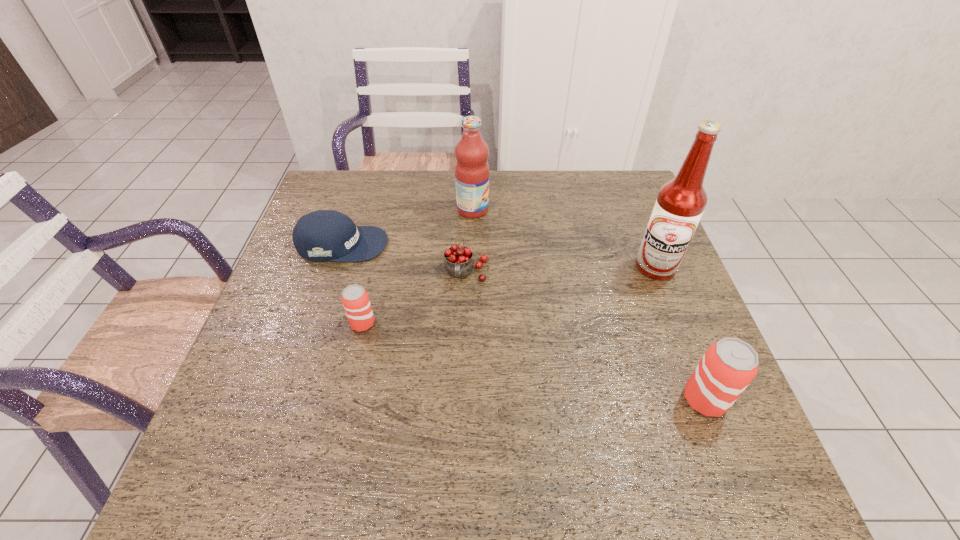
What are the coordinates of `free space located on the back of the right beer can` in the screenshot? It's located at (680, 335).

I want to click on vacant space situated on the front label of the farthest object, so click(544, 210).

You are a GUI agent. You are given a task and a screenshot of the screen. Output one action in this format:
    pyautogui.click(x=<x>, y=<y>)
    Task: Click on the vacant space situated 0.320m on the front-facing side of the baseball cap
    
    Given the screenshot: What is the action you would take?
    pyautogui.click(x=502, y=244)

Find the location of a particular element. This screenshot has height=540, width=960. free region located 0.100m on the label side of the tallest object is located at coordinates (673, 312).

Locate an element on the screen. This screenshot has width=960, height=540. vacant space situated on the handle side of the cherry is located at coordinates (464, 352).

You are a GUI agent. You are given a task and a screenshot of the screen. Output one action in this format:
    pyautogui.click(x=<x>, y=<y>)
    Task: Click on the object located in the far edge section of the desktop
    The image size is (960, 540).
    Given the screenshot: What is the action you would take?
    pyautogui.click(x=471, y=170)

Locate an element on the screen. The height and width of the screenshot is (540, 960). object that is at the near edge is located at coordinates (728, 366).

Find the location of a particular element. object that is at the left edge is located at coordinates (324, 235).

Image resolution: width=960 pixels, height=540 pixels. I want to click on beer can present at the right edge, so click(728, 366).

You are a GUI agent. You are given a task and a screenshot of the screen. Output one action in this format:
    pyautogui.click(x=<x>, y=<y>)
    Task: Click on the alcohol that is at the right edge
    The height and width of the screenshot is (540, 960).
    Given the screenshot: What is the action you would take?
    pyautogui.click(x=680, y=203)